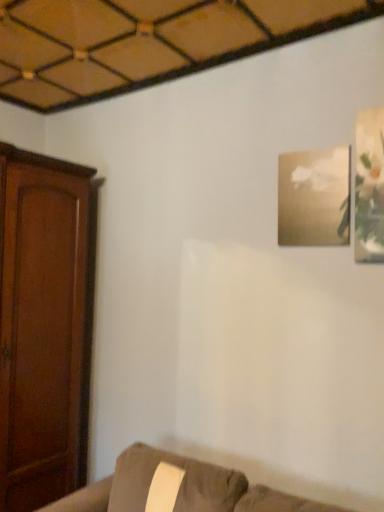
Question: Considering the relative positions of gold textured frame at upper right, the second picture frame in the right-to-left sequence, and suede couch at lower right in the image provided, is gold textured frame at upper right, the second picture frame in the right-to-left sequence, to the right of suede couch at lower right from the viewer's perspective?

Choices:
 (A) no
 (B) yes

Answer: (B)

Question: Is gold textured frame at upper right, the second picture frame in the right-to-left sequence, outside suede couch at lower right?

Choices:
 (A) no
 (B) yes

Answer: (B)

Question: From the image's perspective, is gold textured frame at upper right, the 1th picture frame positioned from the left, beneath suede couch at lower right?

Choices:
 (A) no
 (B) yes

Answer: (A)

Question: Considering the relative positions of gold textured frame at upper right, positioned as the second picture frame in front-to-back order, and suede couch at lower right in the image provided, is gold textured frame at upper right, positioned as the second picture frame in front-to-back order, to the left of suede couch at lower right from the viewer's perspective?

Choices:
 (A) yes
 (B) no

Answer: (B)

Question: From the image's perspective, does gold textured frame at upper right, placed as the first picture frame when sorted from back to front, appear higher than suede couch at lower right?

Choices:
 (A) no
 (B) yes

Answer: (B)

Question: Considering the relative sizes of gold textured frame at upper right, placed as the first picture frame when sorted from back to front, and suede couch at lower right in the image provided, is gold textured frame at upper right, placed as the first picture frame when sorted from back to front, shorter than suede couch at lower right?

Choices:
 (A) yes
 (B) no

Answer: (A)

Question: Is the depth of matte white frame at upper right, positioned as the first picture frame in front-to-back order, less than that of gold textured frame at upper right, placed as the first picture frame when sorted from back to front?

Choices:
 (A) yes
 (B) no

Answer: (A)

Question: From a real-world perspective, is matte white frame at upper right, the 2th picture frame viewed from the back, physically above gold textured frame at upper right, positioned as the second picture frame in front-to-back order?

Choices:
 (A) no
 (B) yes

Answer: (B)

Question: Could you tell me if matte white frame at upper right, positioned as the first picture frame in front-to-back order, is facing gold textured frame at upper right, placed as the first picture frame when sorted from back to front?

Choices:
 (A) yes
 (B) no

Answer: (B)

Question: Would you say matte white frame at upper right, the 2th picture frame viewed from the back, contains gold textured frame at upper right, the second picture frame in the right-to-left sequence?

Choices:
 (A) yes
 (B) no

Answer: (B)

Question: Is the depth of matte white frame at upper right, positioned as the first picture frame in front-to-back order, greater than that of gold textured frame at upper right, the second picture frame in the right-to-left sequence?

Choices:
 (A) no
 (B) yes

Answer: (A)

Question: From the image's perspective, is matte white frame at upper right, positioned as the first picture frame in front-to-back order, below gold textured frame at upper right, the 1th picture frame positioned from the left?

Choices:
 (A) yes
 (B) no

Answer: (B)

Question: Does suede couch at lower right come in front of matte white frame at upper right, the 2th picture frame viewed from the back?

Choices:
 (A) no
 (B) yes

Answer: (B)